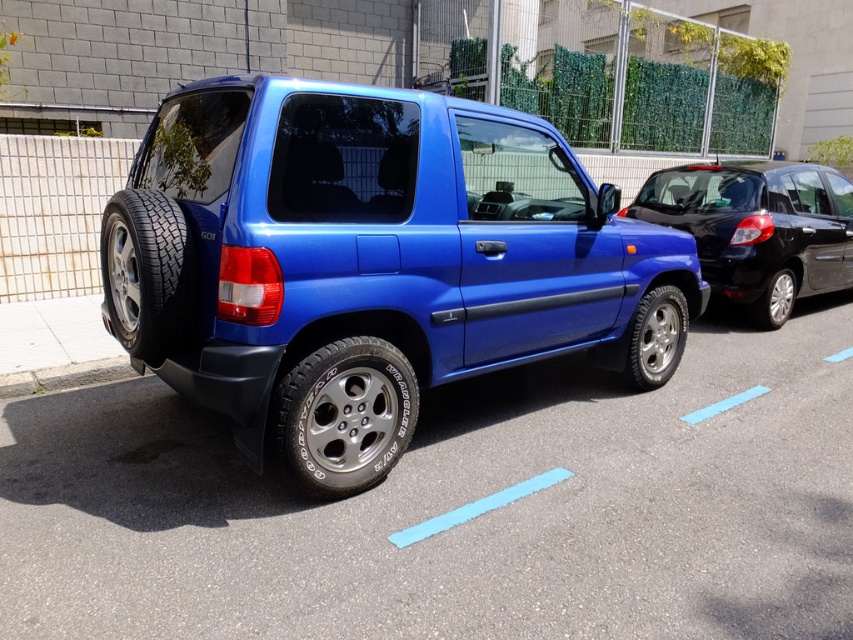
Question: Which point is farther to the camera?

Choices:
 (A) (824, 228)
 (B) (47, 380)
 (C) (779, 321)

Answer: (A)

Question: Which point appears closest to the camera in this image?

Choices:
 (A) (718, 192)
 (B) (70, 371)

Answer: (B)

Question: Is glossy black sedan at right smaller than black rubber tire at right?

Choices:
 (A) yes
 (B) no

Answer: (B)

Question: Can you confirm if metallic blue suv at center is smaller than glossy black sedan at right?

Choices:
 (A) no
 (B) yes

Answer: (A)

Question: Based on their relative distances, which object is farther from the gray concrete curb at lower left?

Choices:
 (A) metallic blue car at center
 (B) glossy black sedan at right

Answer: (B)

Question: Can you confirm if glossy black sedan at right is positioned above metallic silver tire at lower right?

Choices:
 (A) yes
 (B) no

Answer: (A)